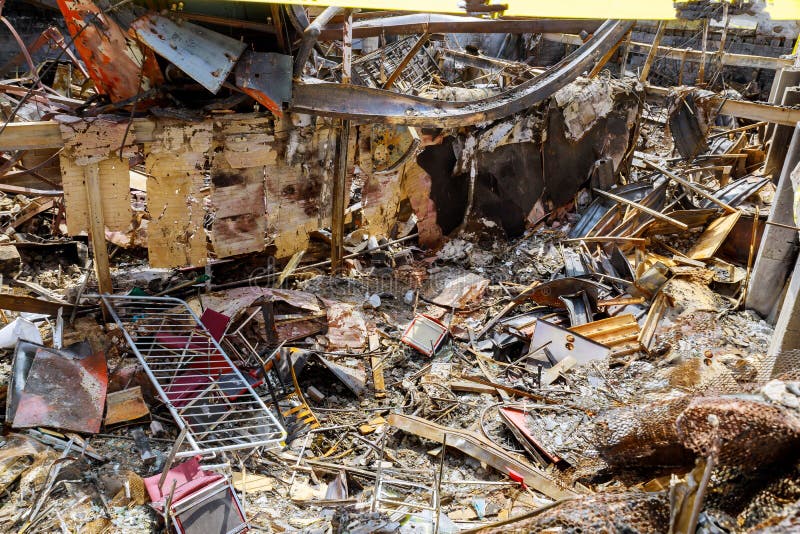
Where is `bed frame`? Image resolution: width=800 pixels, height=534 pixels. bed frame is located at coordinates (250, 407).